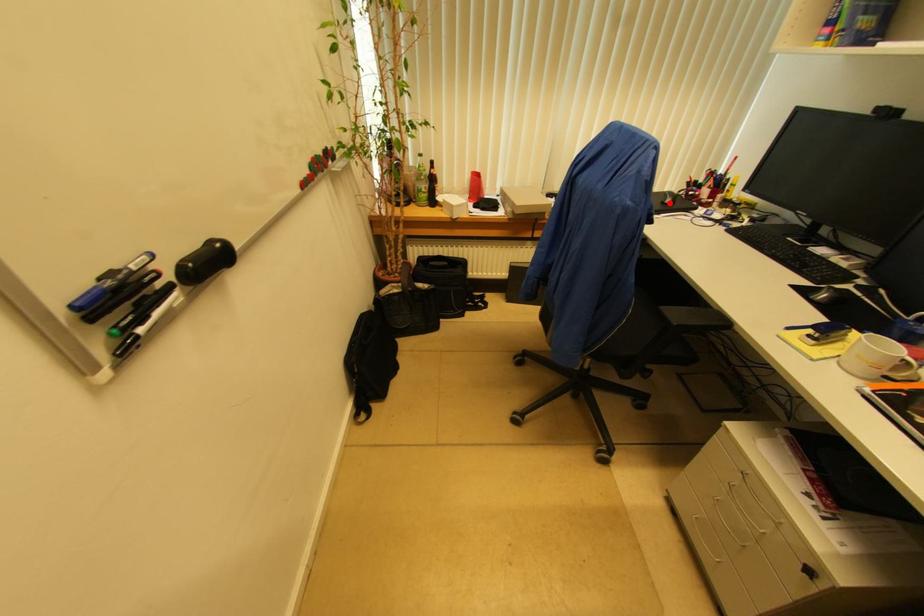
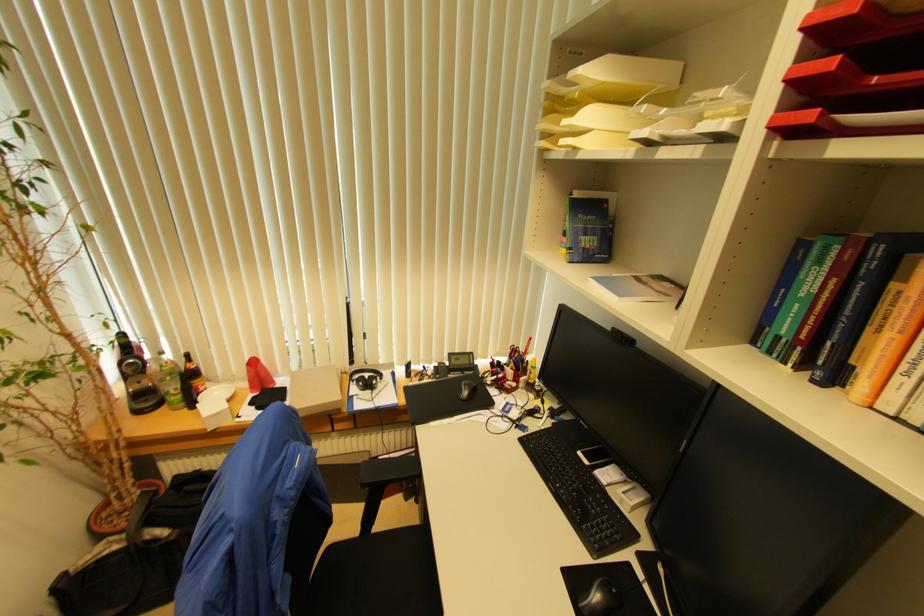
Question: I am providing you with two images of the same scene from different viewpoints. A red point is shown in image1. For the corresponding object point in image2, is it positioned nearer or farther from the camera?

Choices:
 (A) Nearer
 (B) Farther

Answer: (A)